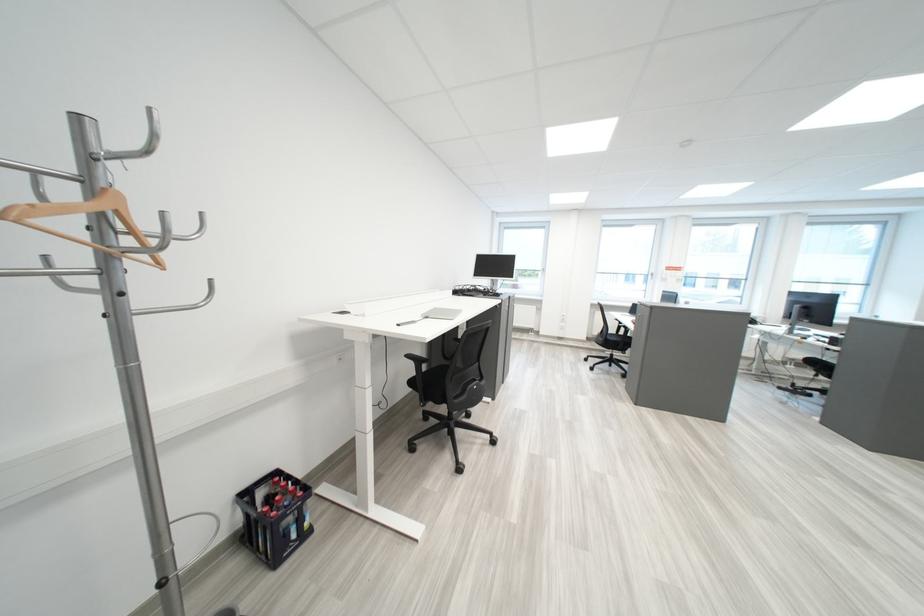
This screenshot has width=924, height=616. What are the coordinates of `wooden clothes hanger` in the screenshot? It's located at (83, 221).